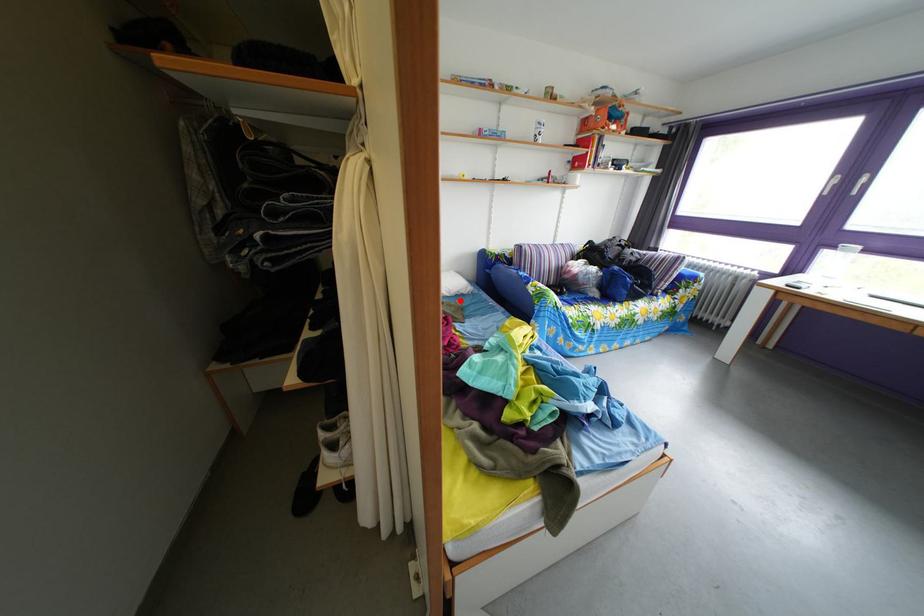
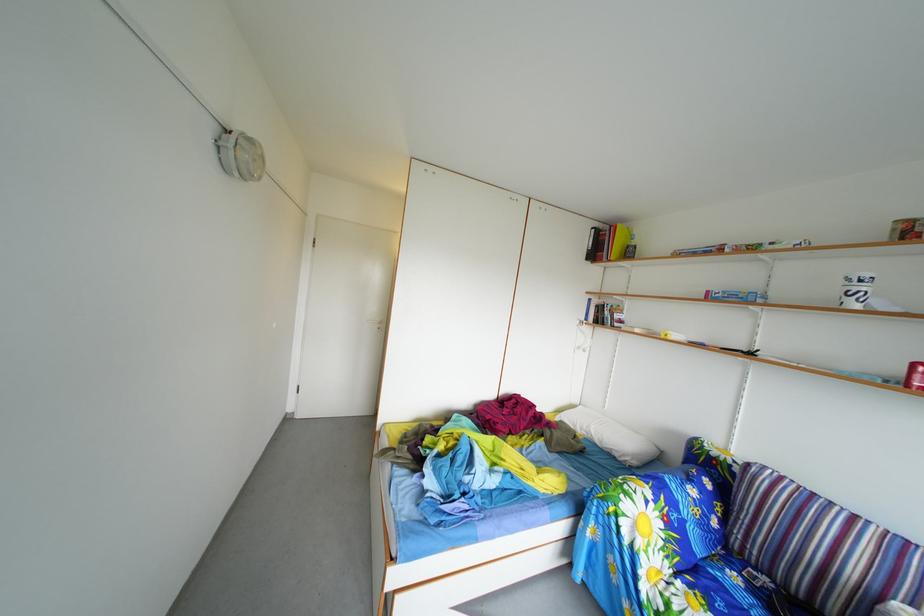
Question: A red point is marked in image1. In image2, is the corresponding 3D point closer to the camera or farther? Reply with the corresponding letter.

Choices:
 (A) The corresponding 3D point is closer.
 (B) The corresponding 3D point is farther.

Answer: (B)